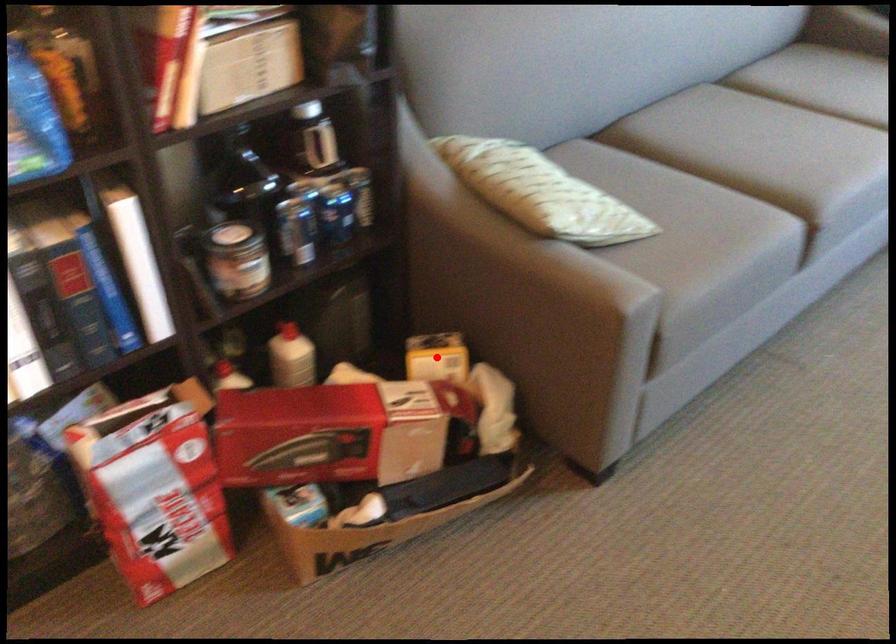
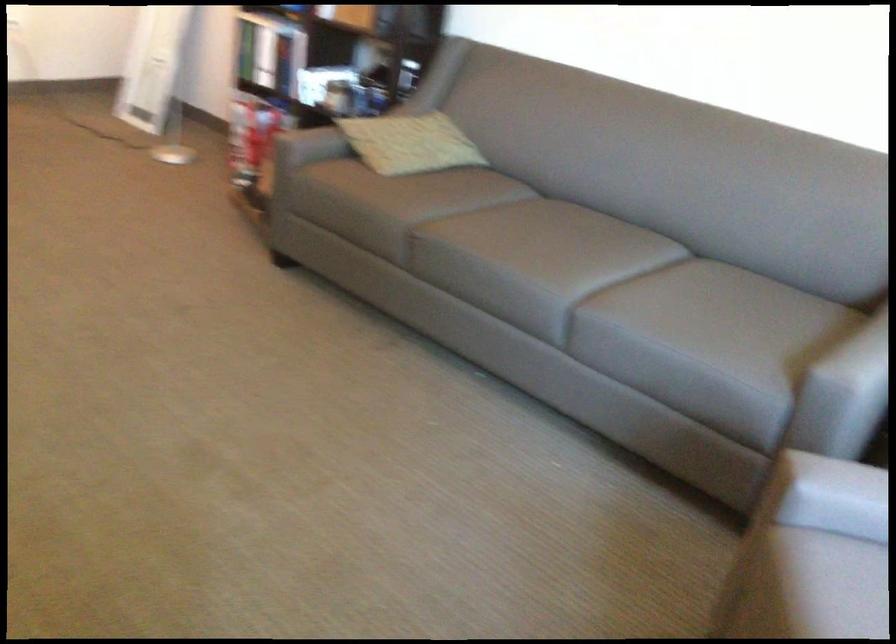
Question: I am providing you with two images of the same scene from different viewpoints. A red point is marked on the first image. Is the red point's position out of view in image 2?

Choices:
 (A) Yes
 (B) No

Answer: (A)